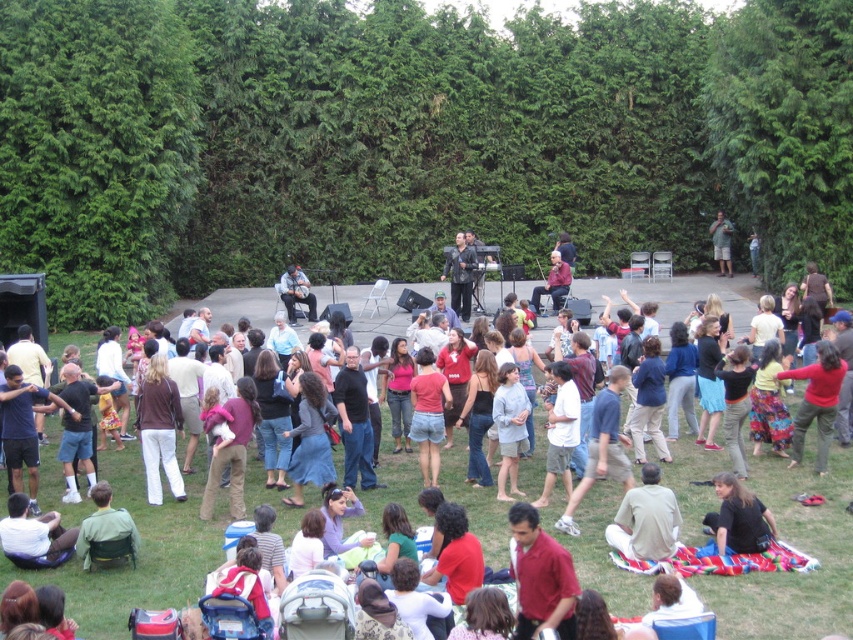
You are standing at the origin point of the image coordinate system. You want to walk to point A at point (16, 516) and point B at point (113, 512). Which point is further away from you?

Point A at point (16, 516) is further away from you because it is behind point B at point (113, 512).

You are a photographer standing at the edge of the grassy area. You want to take a photo that includes both the matte black laptop at center and the green fabric jacket at lower left. Given that your camera has a maximum focus range of 4 meters, will you be able to capture both objects in the same frame without moving your position?

The matte black laptop at center and green fabric jacket at lower left are 4.07 meters apart from each other. Since the distance between them exceeds the camera maximum focus range of 4 meters, you cannot capture both objects in the same frame without moving your position.

You are at the outdoor gathering and want to take a photo of both the white cotton shirt at lower left and the green fabric jacket at lower left. Which one should you focus on first if you want to capture both in the same frame?

The white cotton shirt at lower left is located below the green fabric jacket at lower left, so you should focus on the green fabric jacket at lower left first to ensure both are in the frame.